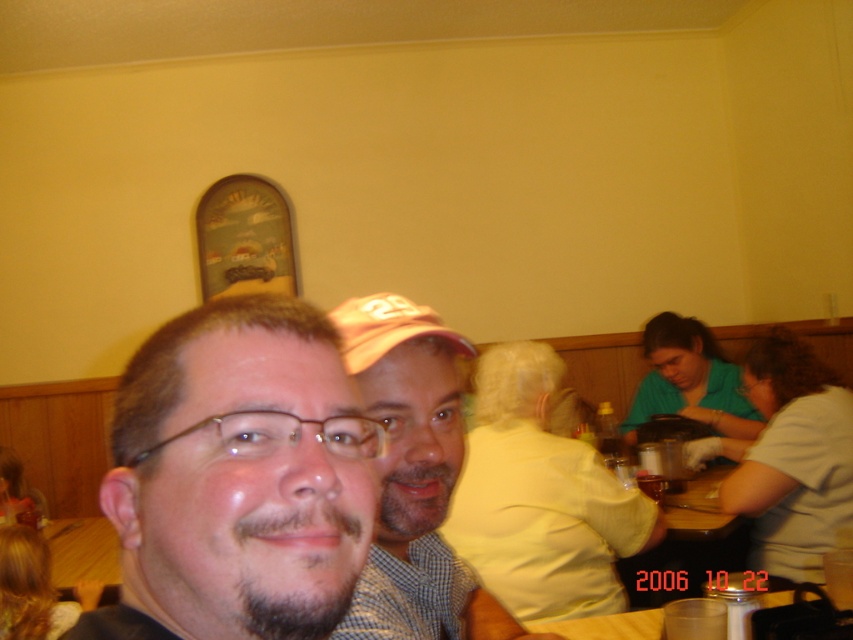
You are a delivery person who needs to place a small package between the matte black shirt at left and the checkered fabric shirt at center. Can you fit it there if the package is 6 inches long?

The distance between the matte black shirt at left and the checkered fabric shirt at center is 6.66 inches, so a 6 inch package can fit between them.

You are a photographer standing in front of the matte black shirt at left. You want to take a clear photo of it without any blur. The camera you are using has a minimum focusing distance of 15 inches. Can you take the photo clearly?

The matte black shirt at left and viewer are 14.59 inches apart from each other, which is less than the camera minimum focusing distance of 15 inches. Therefore, you cannot take a clear photo without blur.